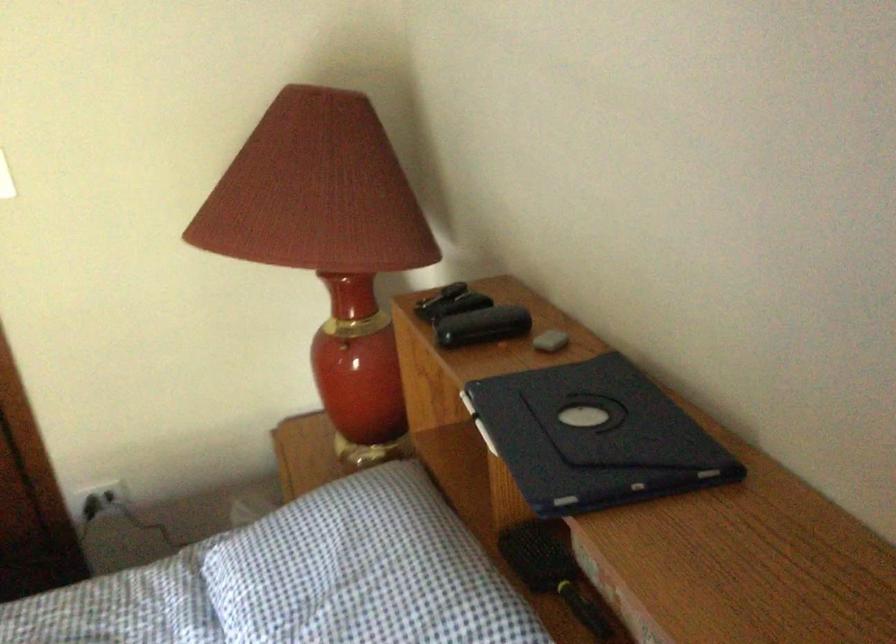
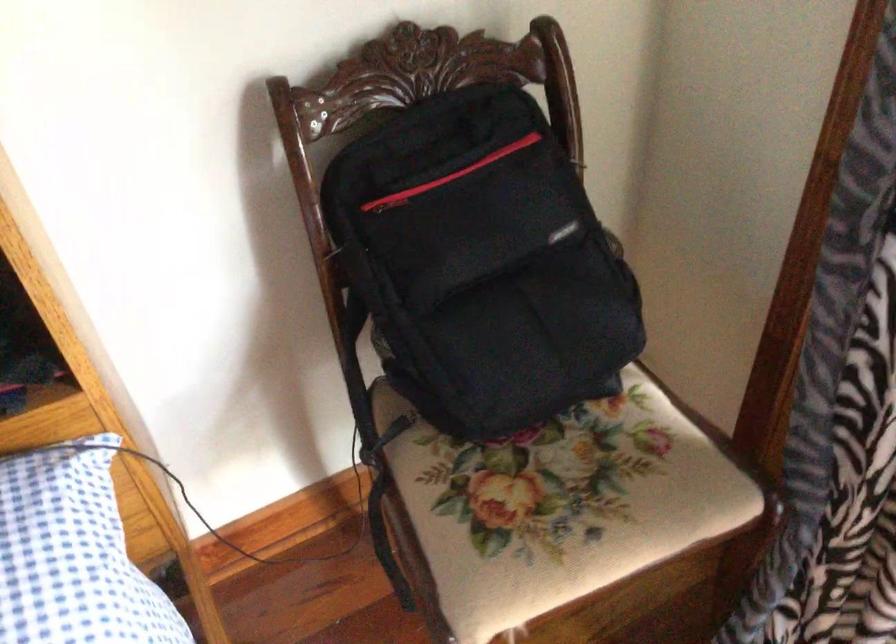
How did the camera likely rotate?

The camera's rotation is toward right-down.